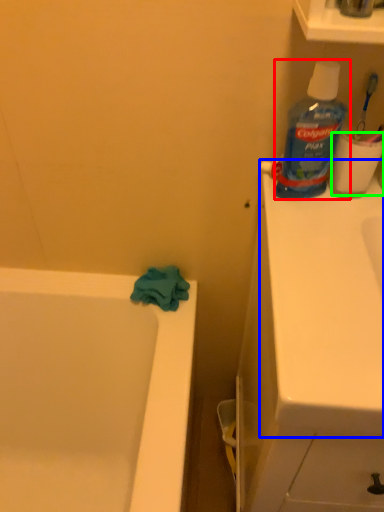
Question: Which object is positioned closest to bottle (highlighted by a red box)? Select from counter top (highlighted by a blue box) and toilet paper (highlighted by a green box).

Choices:
 (A) counter top
 (B) toilet paper

Answer: (B)